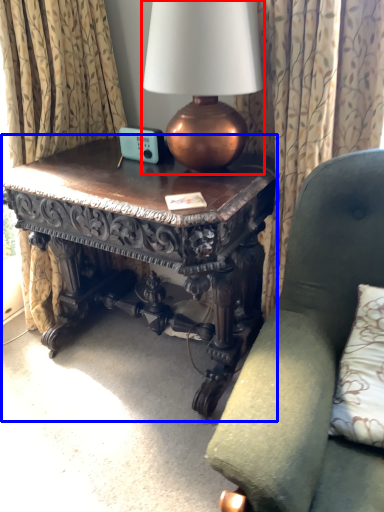
Question: Which object is further to the camera taking this photo, lamp (highlighted by a red box) or table (highlighted by a blue box)?

Choices:
 (A) lamp
 (B) table

Answer: (B)